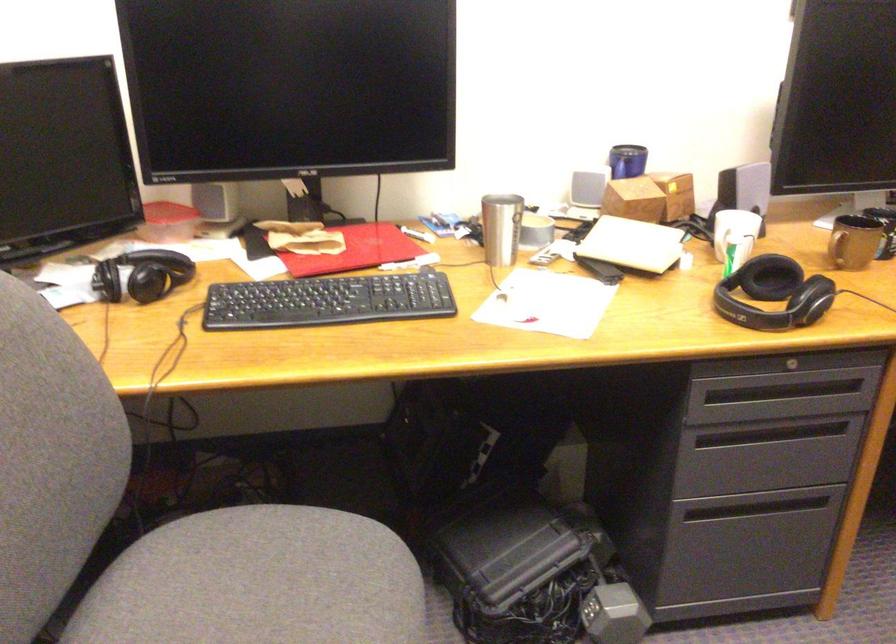
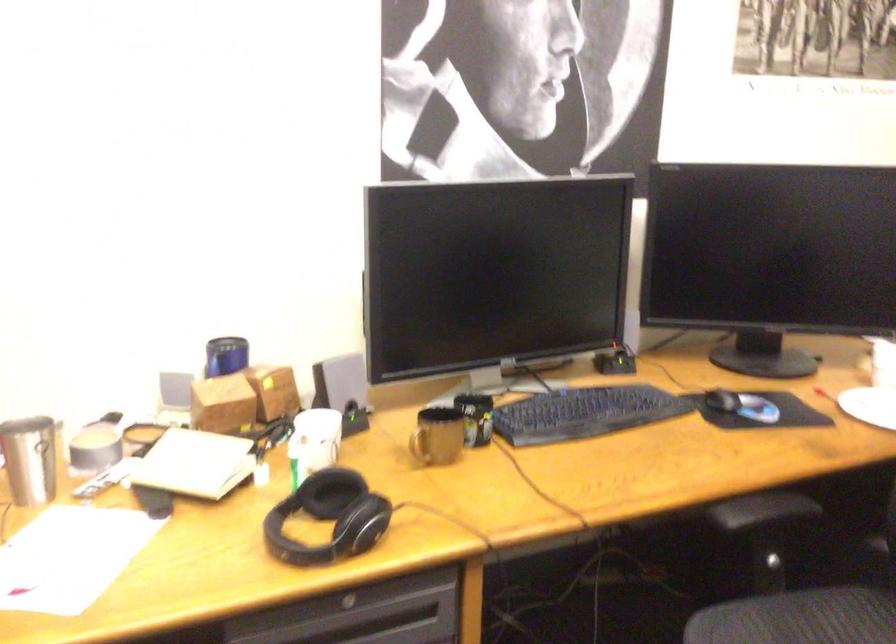
Question: The camera is either moving clockwise (left) or counter-clockwise (right) around the object. The first image is from the beginning of the video and the second image is from the end. Is the camera moving left or right when shooting the video?

Choices:
 (A) Left
 (B) Right

Answer: (A)